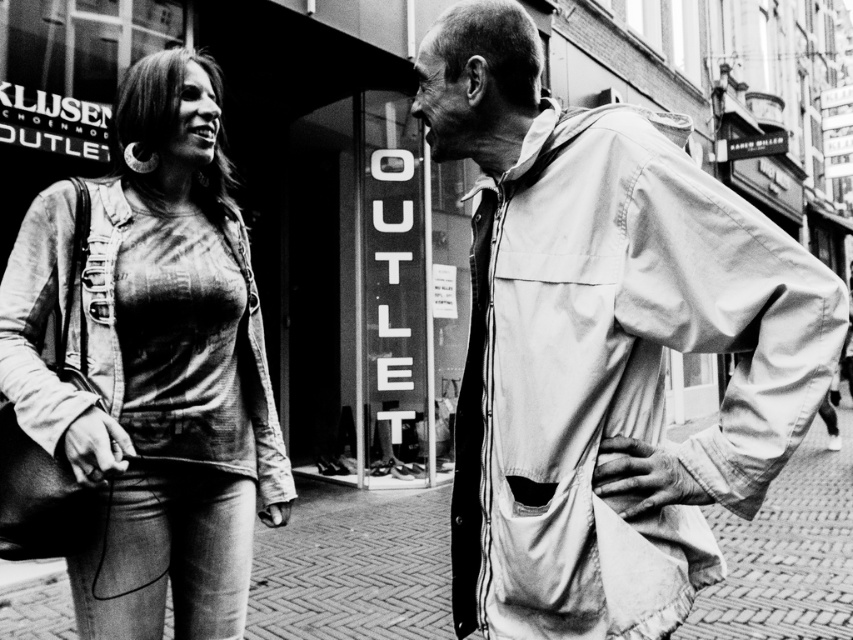
Does light beige fabric jacket at right appear on the right side of brick pavement at lower center?

Indeed, light beige fabric jacket at right is positioned on the right side of brick pavement at lower center.

Can you confirm if light beige fabric jacket at right is shorter than brick pavement at lower center?

No.

Where is `light beige fabric jacket at right`? Image resolution: width=853 pixels, height=640 pixels. light beige fabric jacket at right is located at coordinates (602, 340).

Does ripped denim jacket at left have a smaller size compared to brick pavement at lower center?

Actually, ripped denim jacket at left might be larger than brick pavement at lower center.

Is ripped denim jacket at left further to camera compared to brick pavement at lower center?

No.

Does point (257, 476) come closer to viewer compared to point (361, 621)?

Yes, point (257, 476) is in front of point (361, 621).

Identify the location of ripped denim jacket at left. (154, 365).

Is light beige fabric jacket at right to the right of ripped denim jacket at left from the viewer's perspective?

Correct, you'll find light beige fabric jacket at right to the right of ripped denim jacket at left.

Does light beige fabric jacket at right appear under ripped denim jacket at left?

Actually, light beige fabric jacket at right is above ripped denim jacket at left.

The height and width of the screenshot is (640, 853). Describe the element at coordinates (602, 340) in the screenshot. I see `light beige fabric jacket at right` at that location.

At what (x,y) coordinates should I click in order to perform the action: click on light beige fabric jacket at right. Please return your answer as a coordinate pair (x, y). Looking at the image, I should click on (602, 340).